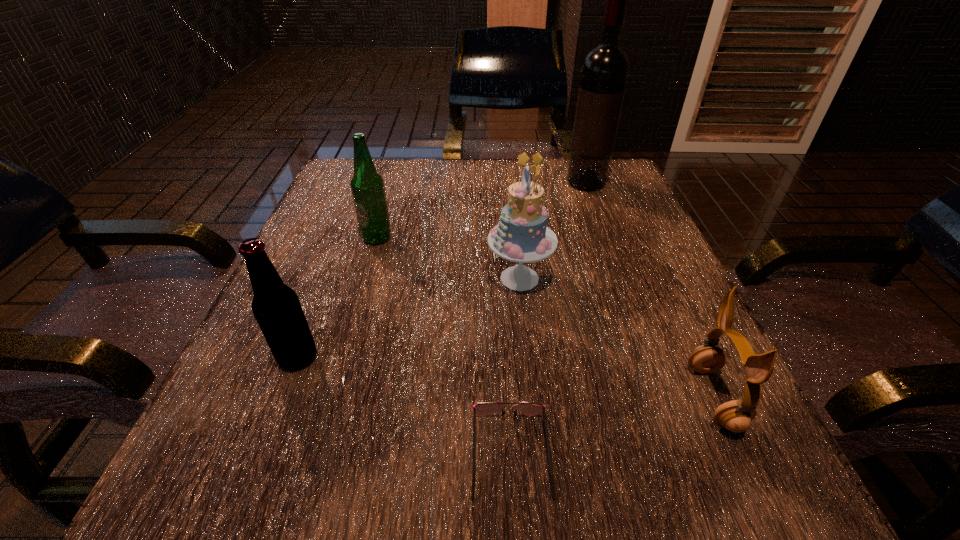
At what (x,y) coordinates should I click in order to perform the action: click on vacant point located with a ladder on the side of the third farthest object. Please return your answer as a coordinate pair (x, y). The height and width of the screenshot is (540, 960). Looking at the image, I should click on (345, 278).

You are a GUI agent. You are given a task and a screenshot of the screen. Output one action in this format:
    pyautogui.click(x=<x>, y=<y>)
    Task: Click on the vacant point located 0.270m with a ladder on the side of the third farthest object
    This screenshot has width=960, height=540.
    Given the screenshot: What is the action you would take?
    pyautogui.click(x=340, y=278)

Where is `free space located 0.300m with a ladder on the side of the third farthest object`? free space located 0.300m with a ladder on the side of the third farthest object is located at coordinates (324, 278).

Image resolution: width=960 pixels, height=540 pixels. I want to click on vacant area located 0.370m on the label of the second farthest object, so click(325, 411).

In order to click on free space located 0.270m on the right of the nearer beer bottle in this screenshot , I will do `click(495, 357)`.

Find the location of a particular element. Image resolution: width=960 pixels, height=540 pixels. vacant space located on the front-facing side of the fifth tallest object is located at coordinates (573, 397).

Find the location of a particular element. Image resolution: width=960 pixels, height=540 pixels. vacant space located on the front-facing side of the fifth tallest object is located at coordinates (652, 397).

Locate an element on the screen. This screenshot has height=540, width=960. vacant region located on the front-facing side of the fifth tallest object is located at coordinates (523, 397).

Image resolution: width=960 pixels, height=540 pixels. I want to click on object present at the far edge, so click(604, 73).

Locate an element on the screen. object that is at the near edge is located at coordinates (482, 408).